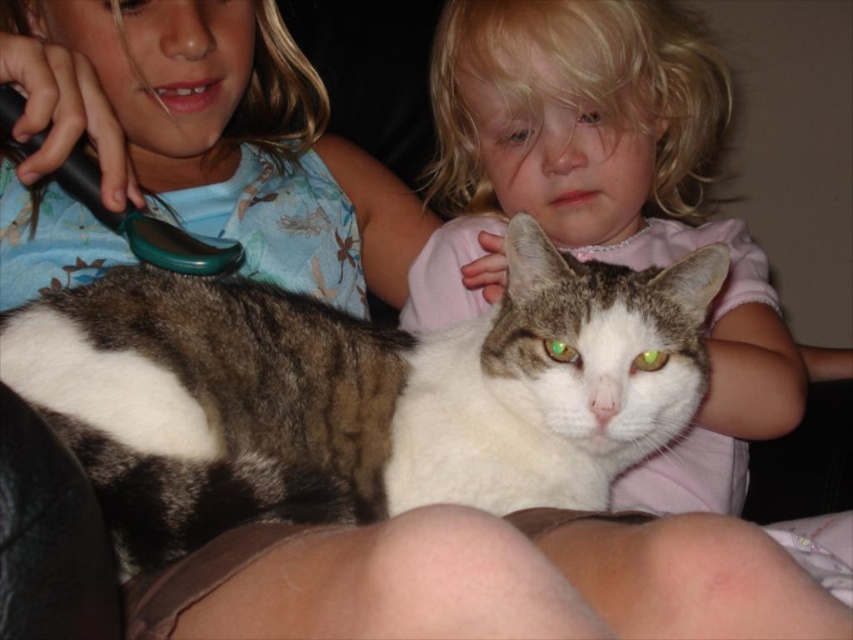
Question: Is tabby fur cat at center bigger than soft pink shirt at center?

Choices:
 (A) no
 (B) yes

Answer: (A)

Question: Does tabby fur cat at center appear on the right side of soft pink shirt at center?

Choices:
 (A) yes
 (B) no

Answer: (B)

Question: Can you confirm if tabby fur cat at center is thinner than soft pink shirt at center?

Choices:
 (A) no
 (B) yes

Answer: (A)

Question: Which object is farther from the camera taking this photo?

Choices:
 (A) tabby fur cat at center
 (B) soft pink shirt at center

Answer: (B)

Question: Which object is farther from the camera taking this photo?

Choices:
 (A) tabby fur cat at center
 (B) soft pink shirt at center

Answer: (B)

Question: Which object appears farthest from the camera in this image?

Choices:
 (A) soft pink shirt at center
 (B) tabby fur cat at center

Answer: (A)